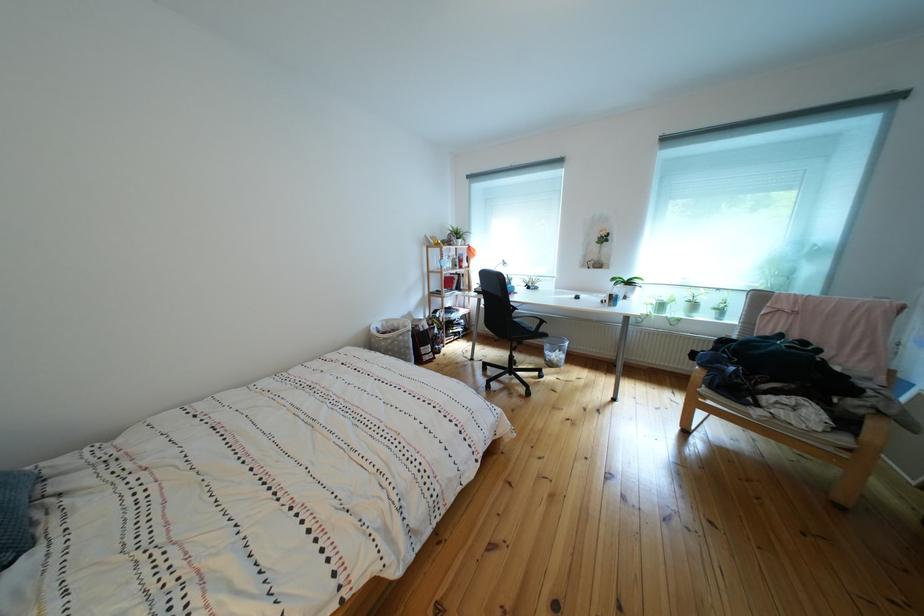
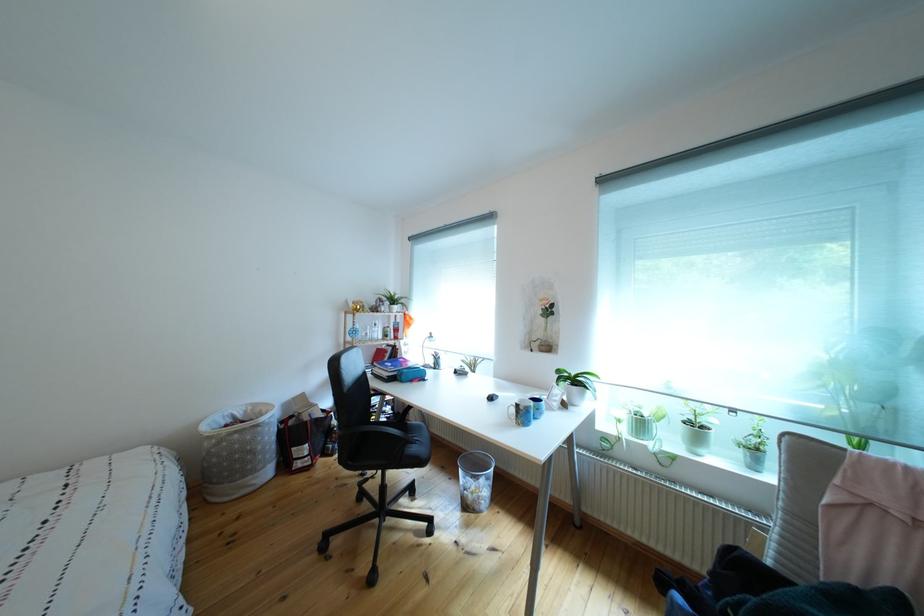
Find the pixel in the second image that matches pixel 419 353 in the first image.

(263, 456)